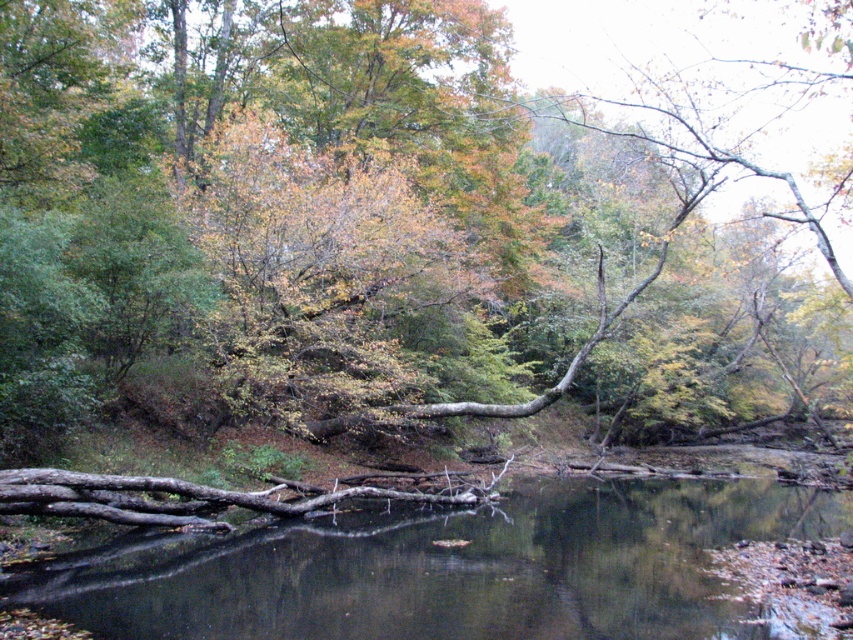
You are standing at the edge of the water and see the brown rough tree trunk at center and the brown wood at center. Which object is taller?

The brown rough tree trunk at center is taller than brown wood at center.